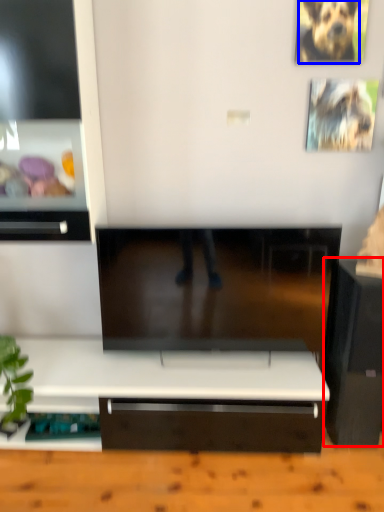
Question: Which point is closer to the camera, furniture (highlighted by a red box) or animal (highlighted by a blue box)?

Choices:
 (A) furniture
 (B) animal

Answer: (A)